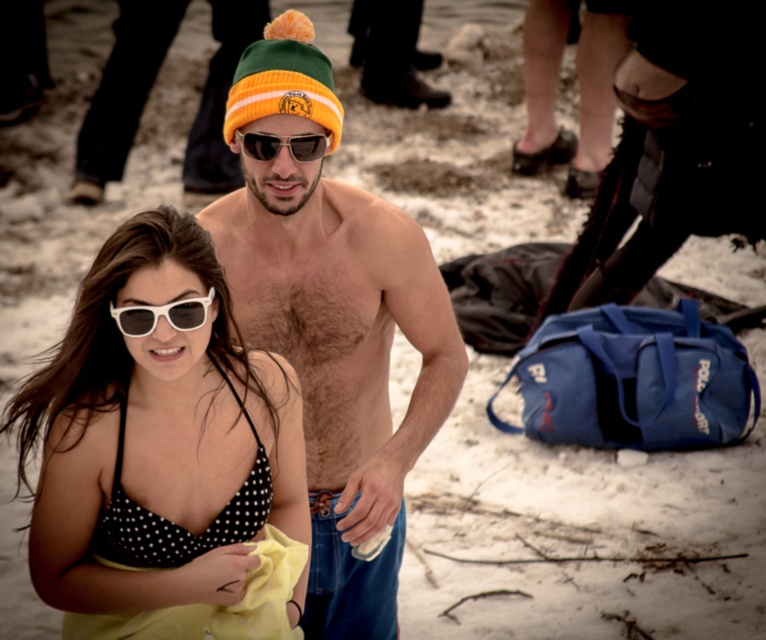
Who is more forward, (269, 113) or (293, 140)?

Point (269, 113) is more forward.

Does shiny orange knit beanie at center have a larger size compared to matte black sunglasses at center?

Yes, shiny orange knit beanie at center is bigger than matte black sunglasses at center.

Between point (326, 193) and point (316, 145), which one is positioned behind?

The point (326, 193) is more distant.

Locate an element on the screen. The height and width of the screenshot is (640, 766). shiny orange knit beanie at center is located at coordinates (332, 323).

From the picture: Does black polka dot bikini top at center have a lesser width compared to white plastic sunglasses at center?

Incorrect, black polka dot bikini top at center's width is not less than white plastic sunglasses at center's.

This screenshot has height=640, width=766. In order to click on black polka dot bikini top at center in this screenshot , I will do `click(156, 436)`.

Which is in front, point (162, 493) or point (149, 321)?

Point (149, 321) is in front.

The height and width of the screenshot is (640, 766). I want to click on black polka dot bikini top at center, so click(x=156, y=436).

Is green/yellow knit beanie at center shorter than white plastic sunglasses at center?

No.

This screenshot has width=766, height=640. I want to click on green/yellow knit beanie at center, so click(283, 77).

At what (x,y) coordinates should I click in order to perform the action: click on green/yellow knit beanie at center. Please return your answer as a coordinate pair (x, y). The height and width of the screenshot is (640, 766). Looking at the image, I should click on (283, 77).